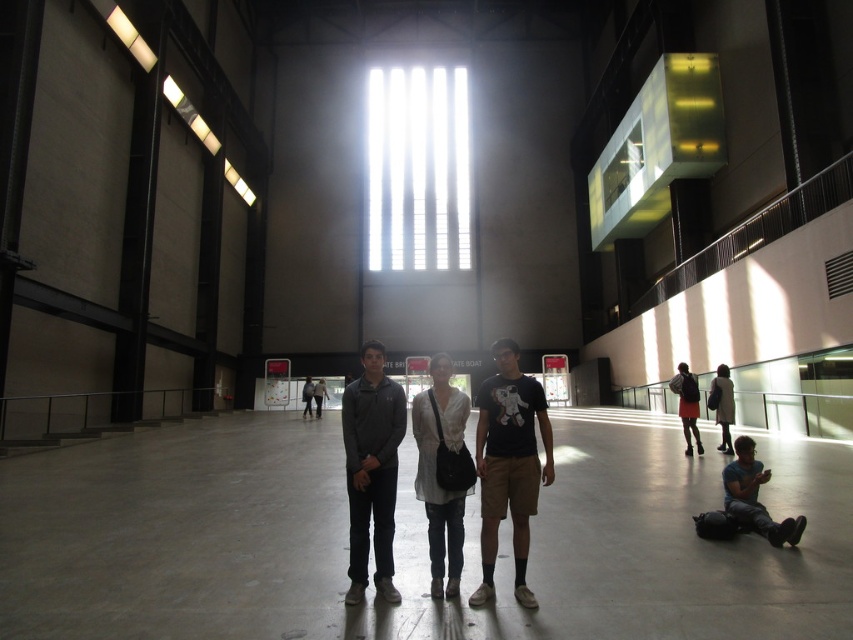
You are a photographer trying to capture a clear shot of both the dark gray sweater at center and the light gray cotton blouse at center. Since they are positioned close to each other, will you be able to focus on both subjects simultaneously without one appearing blurry?

The dark gray sweater at center is in front of the light gray cotton blouse at center, so focusing on the dark gray sweater at center will keep it sharp while the light gray cotton blouse at center may appear slightly out of focus. To capture both clearly, adjust the focus to a point between them or use a smaller aperture for a deeper depth of field.

You are taking a photo of two points in the museum. The first point is labeled as point (527, 417) and the second is point (712, 390). Based on their positions, which point is closer to the camera?

Point (527, 417) is closer to the camera than point (712, 390).